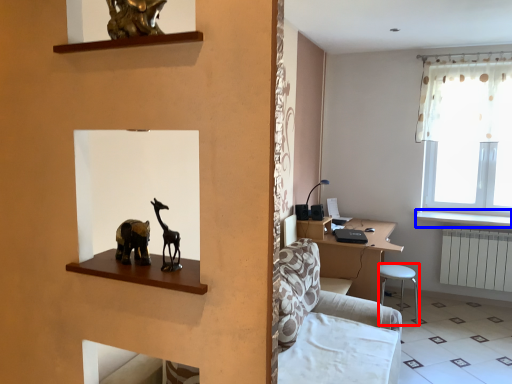
Question: Which of the following is the closest to the observer, bar stool (highlighted by a red box) or window sill (highlighted by a blue box)?

Choices:
 (A) bar stool
 (B) window sill

Answer: (A)